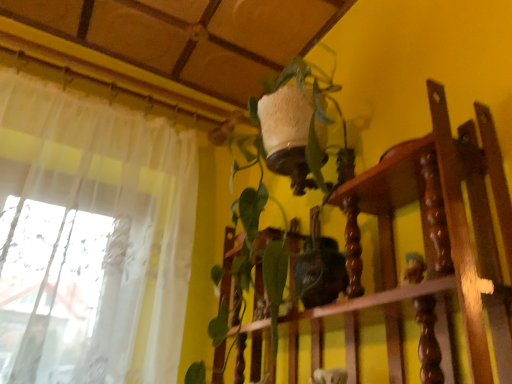
Question: Relative to white textured vase at upper center, is green matte plant at center in front or behind?

Choices:
 (A) behind
 (B) front

Answer: (A)

Question: Looking at their shapes, would you say green matte plant at center is wider or thinner than white textured vase at upper center?

Choices:
 (A) thin
 (B) wide

Answer: (B)

Question: Is green matte plant at center bigger or smaller than white textured vase at upper center?

Choices:
 (A) big
 (B) small

Answer: (A)

Question: In the image, is white textured vase at upper center on the left side or the right side of green matte plant at center?

Choices:
 (A) left
 (B) right

Answer: (B)

Question: Looking at the image, does white textured vase at upper center seem bigger or smaller compared to green matte plant at center?

Choices:
 (A) big
 (B) small

Answer: (B)

Question: Is point (453, 258) closer or farther from the camera than point (313, 74)?

Choices:
 (A) farther
 (B) closer

Answer: (B)

Question: In terms of height, does white textured vase at upper center look taller or shorter compared to green matte plant at center?

Choices:
 (A) short
 (B) tall

Answer: (A)